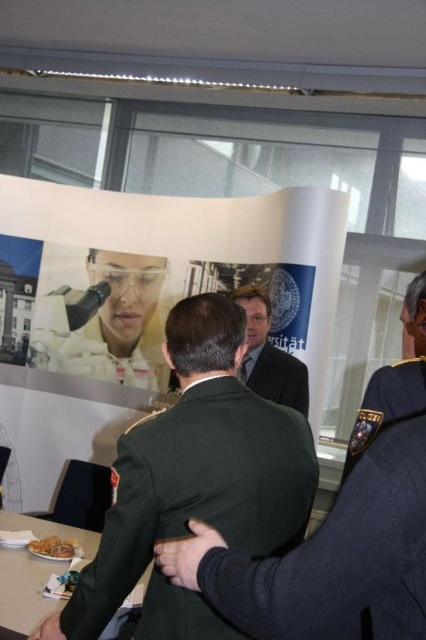
Which is above, green uniform at center or dark green fabric uniform at center?

dark green fabric uniform at center

What do you see at coordinates (196, 467) in the screenshot?
I see `green uniform at center` at bounding box center [196, 467].

Does point (221, 621) come closer to viewer compared to point (344, 525)?

That is False.

This screenshot has width=426, height=640. What are the coordinates of `green uniform at center` in the screenshot? It's located at (196, 467).

Between point (106, 518) and point (394, 392), which one is positioned in front?

Point (106, 518)

Locate an element on the screen. green uniform at center is located at coordinates (196, 467).

Identify the location of green uniform at center. (x=196, y=467).

Between dark green fabric uniform at center and green military uniform at center, which one has more height?

Standing taller between the two is green military uniform at center.

Can you confirm if dark green fabric uniform at center is wider than green military uniform at center?

Incorrect, dark green fabric uniform at center's width does not surpass green military uniform at center's.

Is point (405, 540) farther from camera compared to point (256, 291)?

That is False.

Identify the location of dark green fabric uniform at center. This screenshot has height=640, width=426. (342, 557).